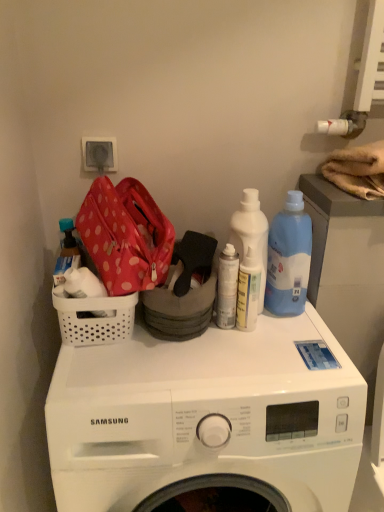
Locate an element on the screen. This screenshot has height=512, width=384. free space in front of white plastic basket at left is located at coordinates (97, 374).